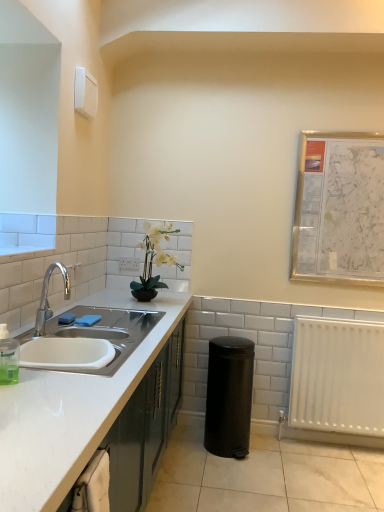
Identify the location of free region under white matte radiator at lower right (from a real-world perspective). The width and height of the screenshot is (384, 512). (349, 442).